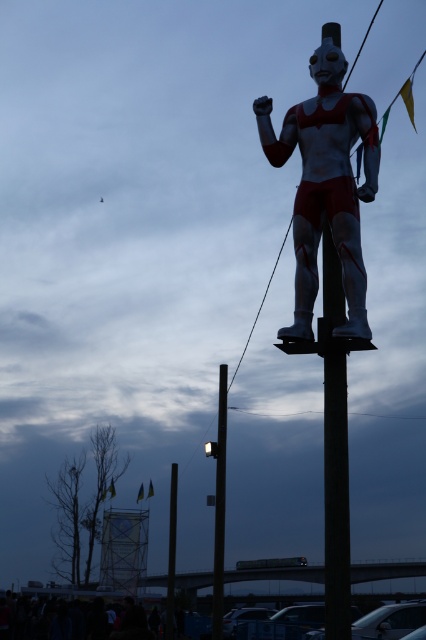
You are a photographer trying to capture the metallic silver figure at center and the black smooth pole at center in a single shot. Since you want the pole to be visible behind the figure, will you need to adjust your camera position to ensure both are in frame?

The metallic silver figure at center is in front of the black smooth pole at center, so you do not need to adjust your camera position because the pole is already behind the figure and both will be visible in the shot.

You are a city planner reviewing the statue installation. The statue is the metallic silver figure at center, and it stands on the black smooth pole at center. Based on the scene, which object is taller?

The black smooth pole at center is taller than the metallic silver figure at center.

In the scene shown: You are an urban planner assessing the height of two poles in the scene. The scene shows a large statue on a pole in a dusky sky with other poles and wires. Which pole is shorter between the metallic pole at center and the black smooth pole at center?

The metallic pole at center is shorter than the black smooth pole at center.